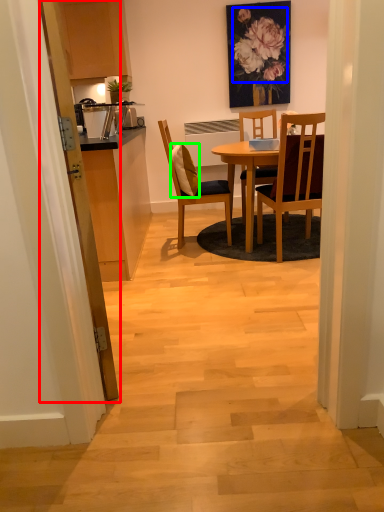
Question: Which is nearer to the glass door (highlighted by a red box)? flower (highlighted by a blue box) or pillow (highlighted by a green box).

Choices:
 (A) flower
 (B) pillow

Answer: (B)